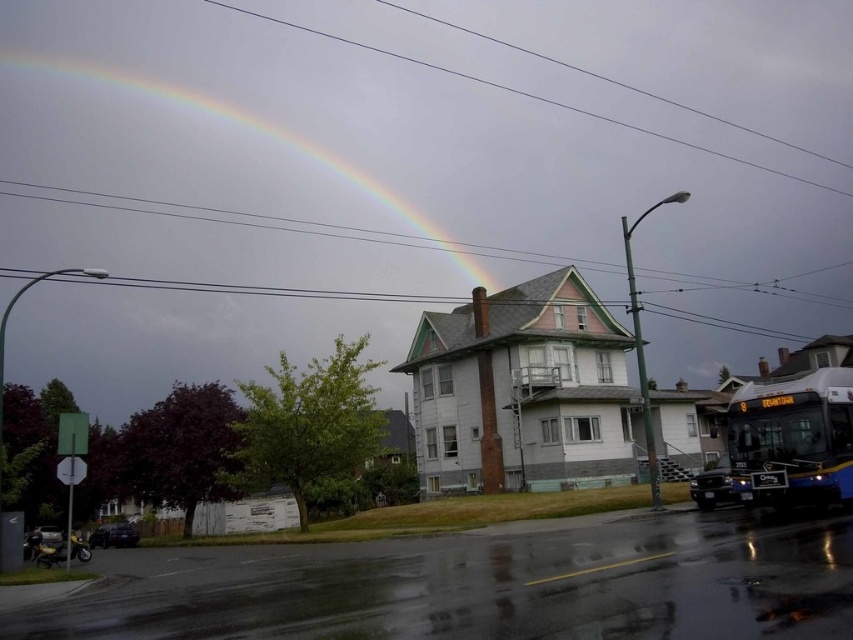
You are a pedestrian standing on the wet street and want to take a photo of the rainbow at upper left without the blue metallic bus at lower right blocking the view. Which direction should you move to ensure the rainbow is visible and the bus is out of frame?

Move to the left side of the blue metallic bus at lower right. Since the bus is below the rainbow at upper left, moving left would position you where the bus no longer blocks the rainbow.

You are standing at the center of the street and want to take the blue metallic bus at lower right. According to the image, which direction should you walk to reach the bus?

The blue metallic bus at lower right is located at point [792,440], so you should walk towards the lower right direction to reach the bus.

You are a pedestrian standing on the wet street and want to take a photo of the rainbow at upper left without the blue metallic bus at lower right blocking the view. Which direction should you move to ensure the rainbow is visible and the bus is out of frame?

To avoid the blue metallic bus at lower right blocking the view, move towards the upper left direction, away from the bus, so the rainbow at upper left becomes visible without the bus obstructing it since the bus is in front of the rainbow.